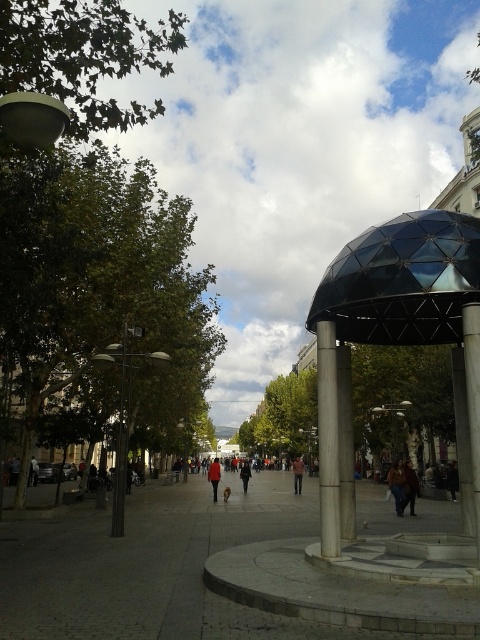
Question: Is gray concrete pavement at center to the right of transparent glass dome at center from the viewer's perspective?

Choices:
 (A) no
 (B) yes

Answer: (A)

Question: Observing the image, what is the correct spatial positioning of gray concrete pavement at center in reference to brown leather jacket at center?

Choices:
 (A) below
 (B) above

Answer: (A)

Question: Estimate the real-world distances between objects in this image. Which object is farther from the red shirt at center?

Choices:
 (A) red fabric coat at center
 (B) gray concrete pavement at center
 (C) brown leather jacket at center

Answer: (C)

Question: Considering the relative positions of gray concrete pavement at center and dark gray fabric jacket at center in the image provided, where is gray concrete pavement at center located with respect to dark gray fabric jacket at center?

Choices:
 (A) left
 (B) right

Answer: (A)

Question: Which of the following is the closest to the observer?

Choices:
 (A) gray concrete pavement at center
 (B) red fabric coat at center
 (C) transparent glass dome at upper right
 (D) brown leather jacket at lower center

Answer: (A)

Question: Which of these objects is positioned farthest from the brown leather jacket at center?

Choices:
 (A) brown leather jacket at lower center
 (B) red shirt at center
 (C) dark gray fabric jacket at center

Answer: (C)